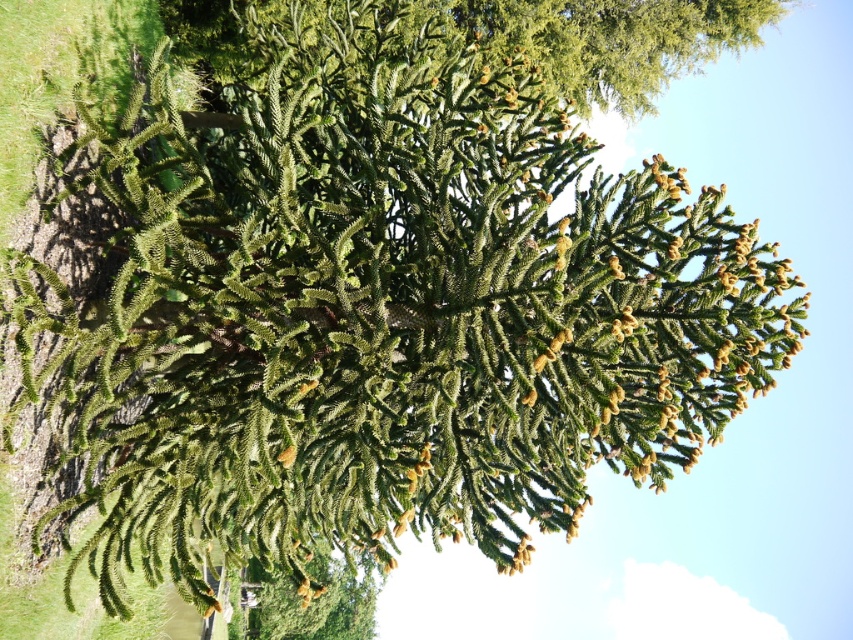
Can you confirm if green needle-like at center is wider than green textured pine cone at lower center?

Indeed, green needle-like at center has a greater width compared to green textured pine cone at lower center.

Is green needle-like at center closer to the viewer compared to green textured pine cone at lower center?

Yes, green needle-like at center is closer to the viewer.

Locate an element on the screen. This screenshot has width=853, height=640. green needle-like at center is located at coordinates (602, 38).

Where is `green needle-like at center`? This screenshot has height=640, width=853. green needle-like at center is located at coordinates (602, 38).